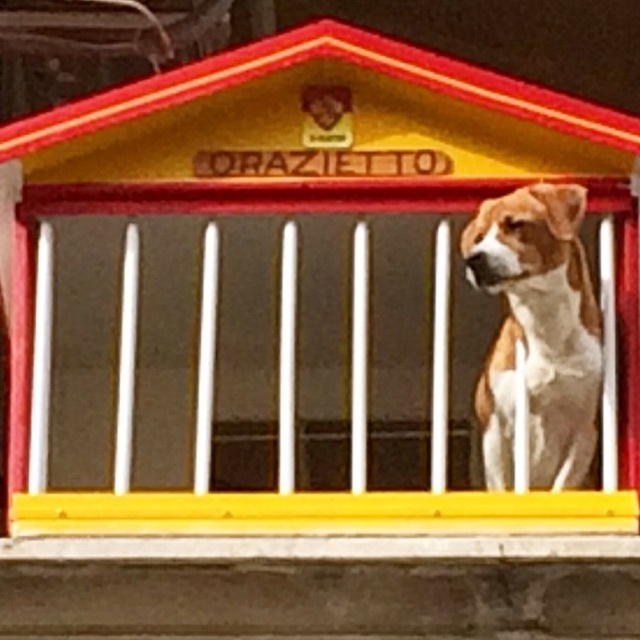
Consider the image. Which is above, yellow matte porch at center or brown and white fur dog at right?

brown and white fur dog at right is above.

Is yellow matte porch at center to the right of brown and white fur dog at right from the viewer's perspective?

Incorrect, yellow matte porch at center is not on the right side of brown and white fur dog at right.

Between point (433, 294) and point (570, 291), which one is positioned in front?

Point (570, 291) is in front.

Locate an element on the screen. The image size is (640, 640). yellow matte porch at center is located at coordinates (289, 420).